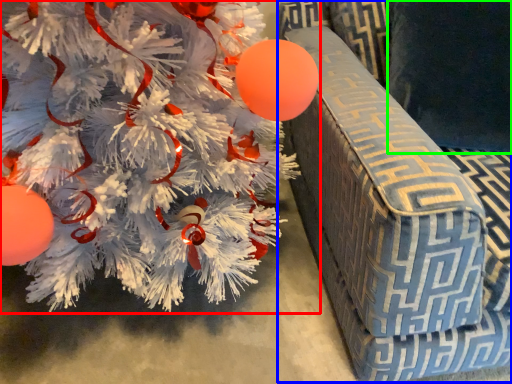
Question: Which object is the farthest from christmas tree (highlighted by a red box)? Choose among these: armchair (highlighted by a blue box) or pillow (highlighted by a green box).

Choices:
 (A) armchair
 (B) pillow

Answer: (B)